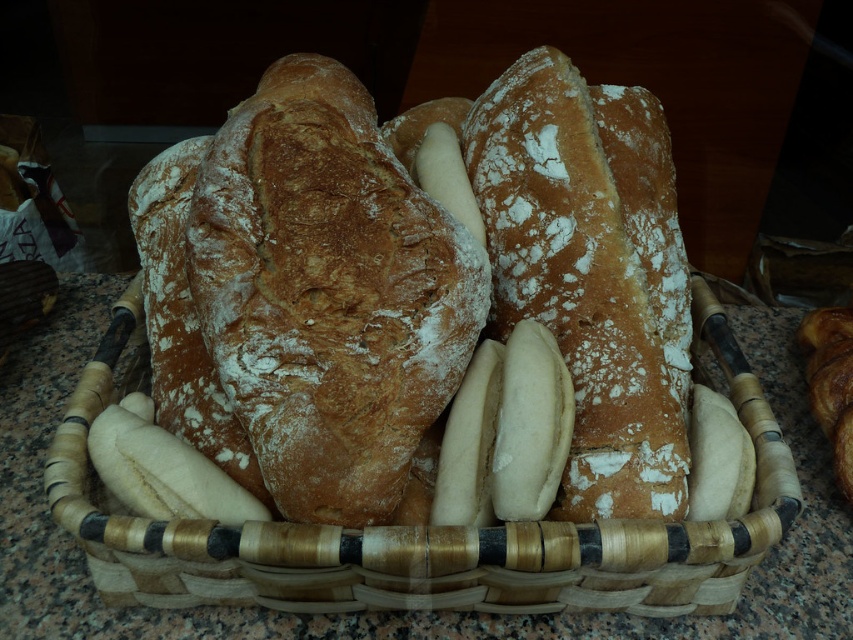
Question: Can you confirm if golden brown crusty loaf at center is wider than brown woven basket at center?

Choices:
 (A) no
 (B) yes

Answer: (A)

Question: Which of these objects is positioned closest to the brown woven basket at center?

Choices:
 (A) golden brown crusty loaf at center
 (B) golden crusty loaf at center

Answer: (A)

Question: Which point appears closest to the camera in this image?

Choices:
 (A) (640, 520)
 (B) (556, 273)
 (C) (635, 300)

Answer: (A)

Question: Can you confirm if golden brown crusty loaf at center is positioned above golden crusty loaf at center?

Choices:
 (A) yes
 (B) no

Answer: (A)

Question: From the image, what is the correct spatial relationship of golden brown crusty loaf at center in relation to brown woven basket at center?

Choices:
 (A) left
 (B) right

Answer: (A)

Question: Among these points, which one is nearest to the camera?

Choices:
 (A) (611, 518)
 (B) (663, 195)

Answer: (A)